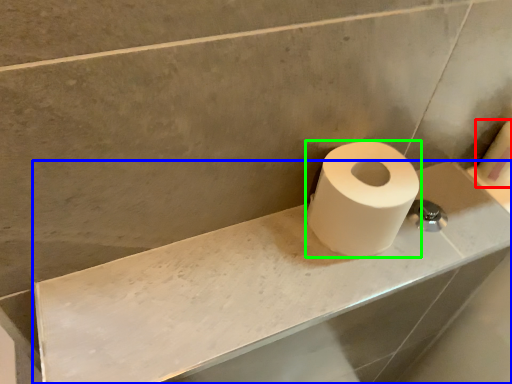
Question: Which object is positioned closest to toilet paper (highlighted by a red box)? Select from counter top (highlighted by a blue box) and toilet paper (highlighted by a green box).

Choices:
 (A) counter top
 (B) toilet paper

Answer: (B)